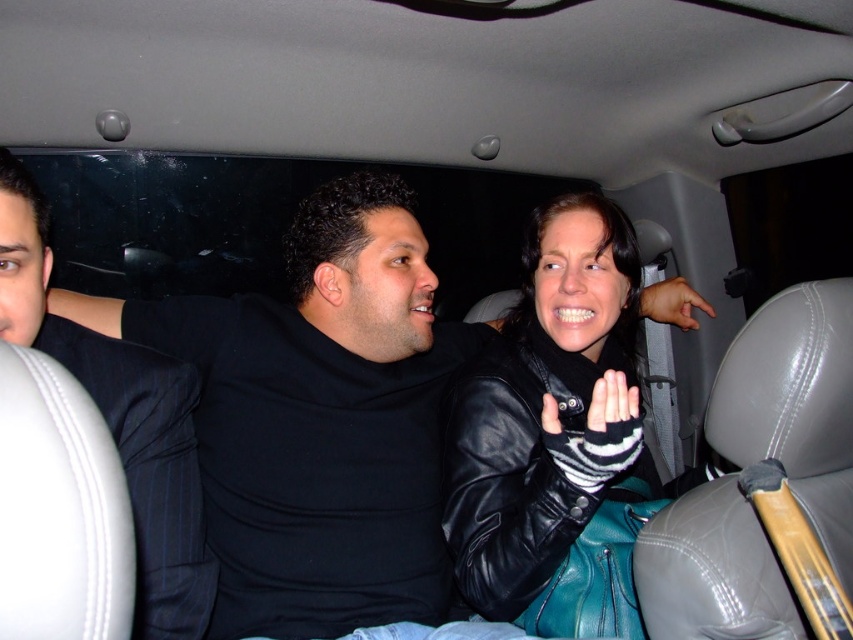
Question: Which object is farther from the camera taking this photo?

Choices:
 (A) black leather hand at center
 (B) black pinstripe suit at left
 (C) black leather jacket at center

Answer: (A)

Question: Is black leather jacket at center behind black pinstripe suit at left?

Choices:
 (A) no
 (B) yes

Answer: (B)

Question: Which object appears closest to the camera in this image?

Choices:
 (A) black leather hand at center
 (B) black leather jacket at center

Answer: (B)

Question: Is black leather jacket at center closer to the viewer compared to black pinstripe suit at left?

Choices:
 (A) yes
 (B) no

Answer: (B)

Question: Is black leather jacket at center to the left of black pinstripe suit at left from the viewer's perspective?

Choices:
 (A) no
 (B) yes

Answer: (A)

Question: Which object is positioned closest to the black leather hand at center?

Choices:
 (A) black leather jacket at center
 (B) black pinstripe suit at left

Answer: (A)